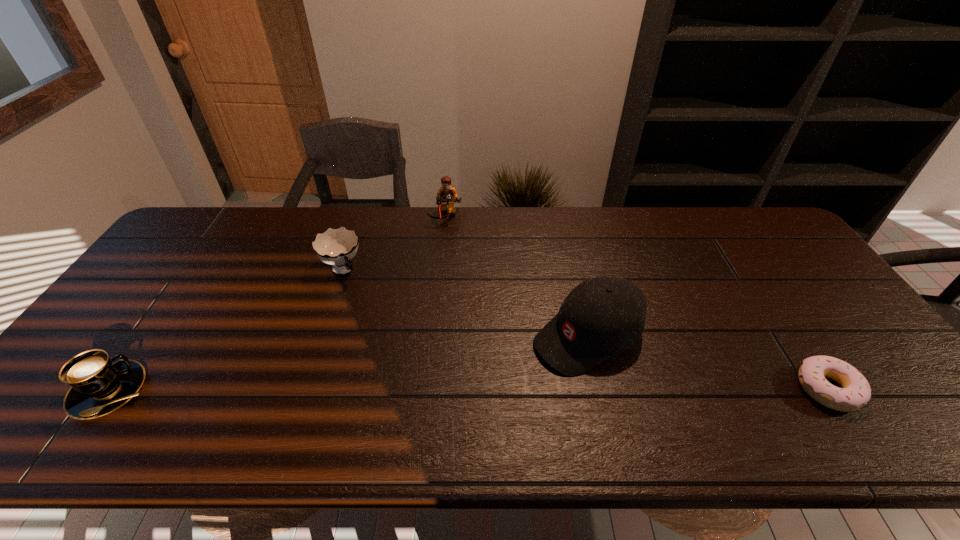
Image resolution: width=960 pixels, height=540 pixels. Find the location of `the leftmost object`. the leftmost object is located at coordinates coord(100,385).

The height and width of the screenshot is (540, 960). Identify the location of doughnut. (855, 393).

Find the location of a particular element. The width and height of the screenshot is (960, 540). the rightmost object is located at coordinates (855, 393).

The width and height of the screenshot is (960, 540). I want to click on the third object from right to left, so click(447, 195).

At what (x,y) coordinates should I click in order to perform the action: click on Lego. Please return your answer as a coordinate pair (x, y). Image resolution: width=960 pixels, height=540 pixels. Looking at the image, I should click on (447, 195).

Where is `the second object from left to right`? The image size is (960, 540). the second object from left to right is located at coordinates (336, 247).

I want to click on the second farthest object, so click(x=336, y=247).

The height and width of the screenshot is (540, 960). I want to click on baseball cap, so click(603, 316).

You are a GUI agent. You are given a task and a screenshot of the screen. Output one action in this format:
    pyautogui.click(x=<x>, y=<y>)
    Task: Click on the free space located 0.190m on the back of the leftmost object
    The image size is (960, 540).
    Given the screenshot: What is the action you would take?
    click(x=170, y=306)

At what (x,y) coordinates should I click in order to perform the action: click on vacant region located on the left of the shortest object. Please return your answer as a coordinate pair (x, y). The width and height of the screenshot is (960, 540). Looking at the image, I should click on (631, 389).